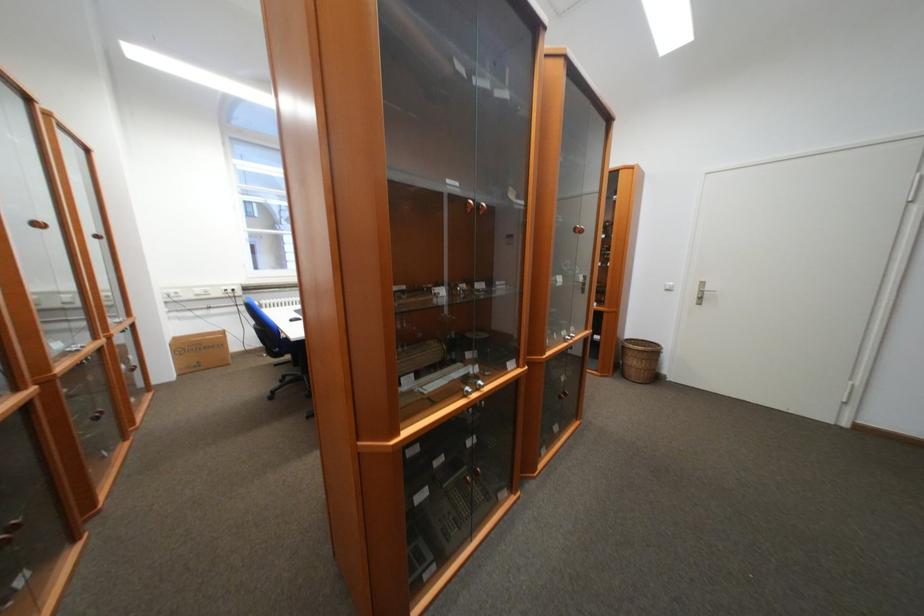
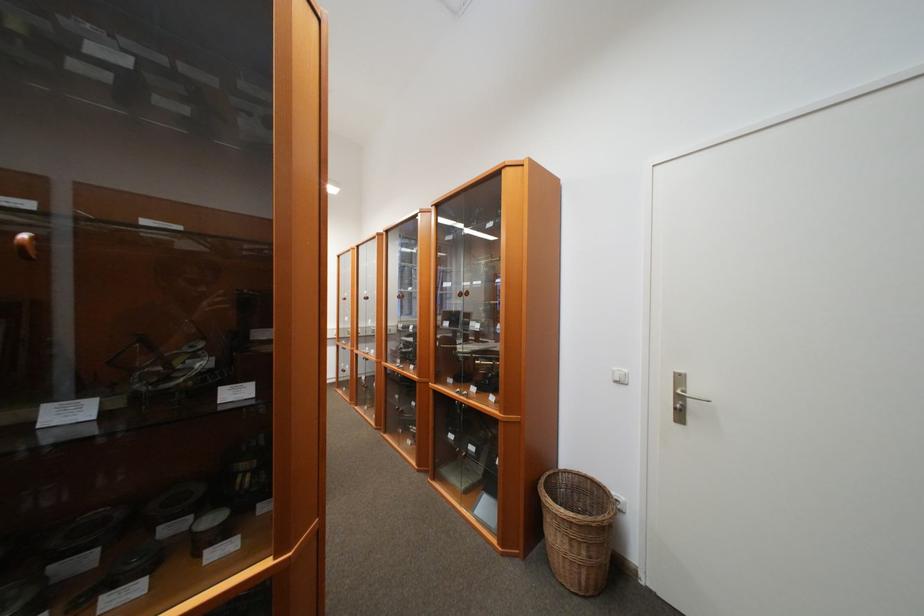
In the second image, find the point that corresponds to the point at 711,293 in the first image.

(689, 399)